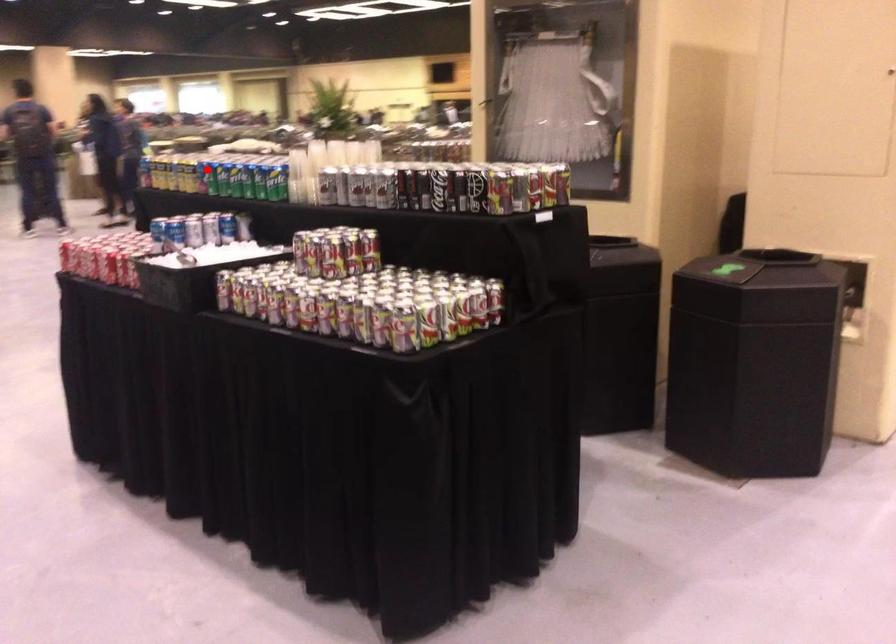
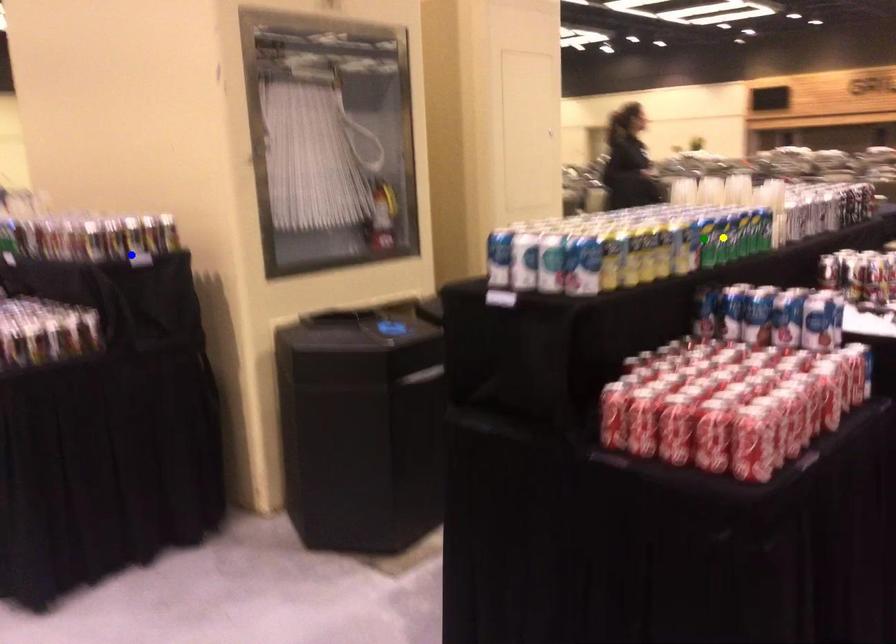
Question: I am providing you with two images of the same scene from different viewpoints. A red point is marked on the first image. You are given multiple points on the second image. In image 2, which mark is for the same physical point as the one in image 1?

Choices:
 (A) yellow point
 (B) blue point
 (C) green point

Answer: (A)